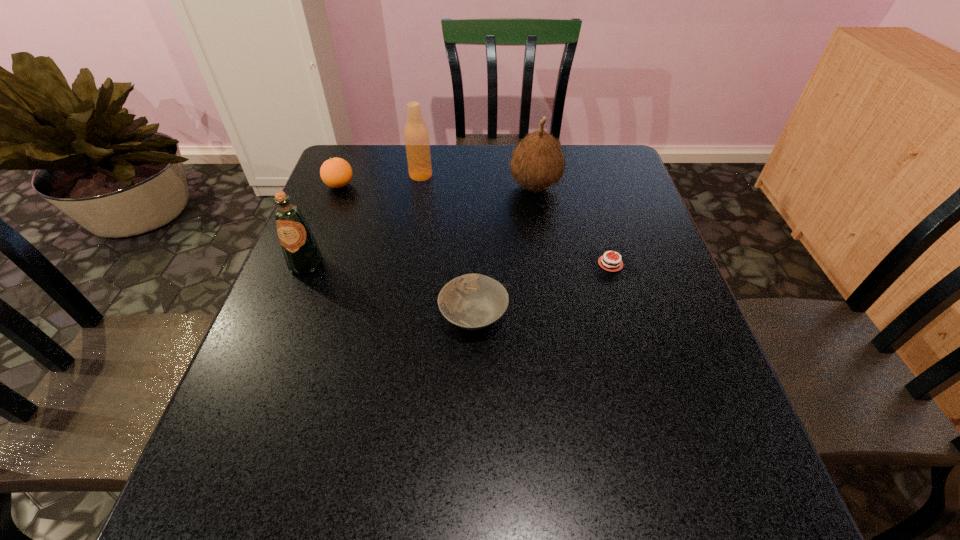
At what (x,y) coordinates should I click in order to perform the action: click on free region located on the surface of the coconut. Please return your answer as a coordinate pair (x, y). Image resolution: width=960 pixels, height=540 pixels. Looking at the image, I should click on (405, 186).

Locate an element on the screen. free spot located 0.290m on the right of the fourth object from right to left is located at coordinates (528, 176).

Locate an element on the screen. Image resolution: width=960 pixels, height=540 pixels. free region located on the front-facing side of the olive oil is located at coordinates (259, 387).

Identify the location of free spot located 0.250m on the front of the third shortest object. (314, 254).

Locate an element on the screen. The height and width of the screenshot is (540, 960). vacant space positioned on the back of the fifth tallest object is located at coordinates (474, 226).

This screenshot has height=540, width=960. What are the coordinates of `vacant space situated on the back of the chocolate cake` in the screenshot? It's located at pos(585,174).

Find the location of a particular element. The image size is (960, 540). coconut that is at the far edge is located at coordinates (538, 162).

Identify the location of beer bottle present at the far edge. pyautogui.click(x=416, y=135).

The width and height of the screenshot is (960, 540). In order to click on orange present at the far edge in this screenshot , I will do `click(336, 172)`.

Where is `olive oil located in the left edge section of the desktop`? This screenshot has height=540, width=960. olive oil located in the left edge section of the desktop is located at coordinates (302, 254).